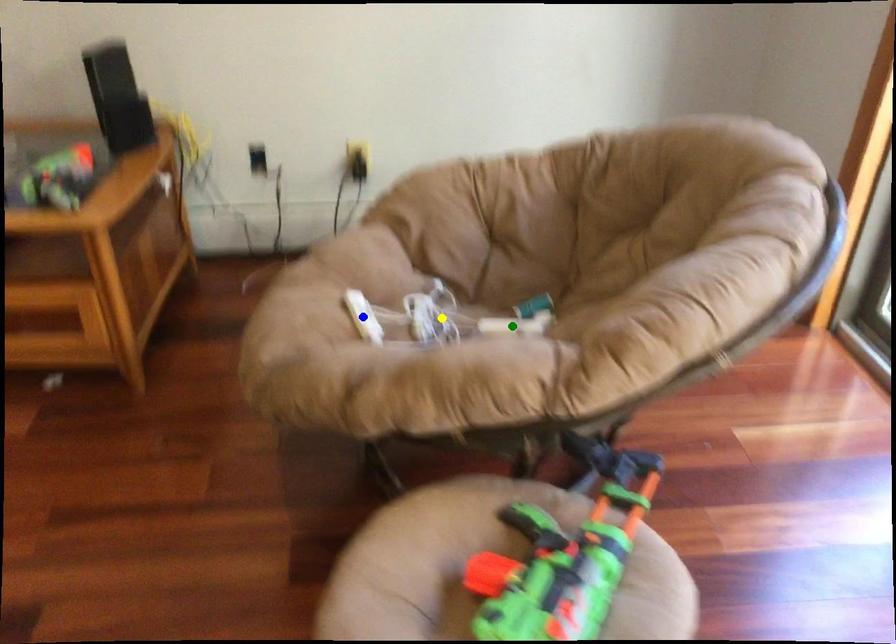
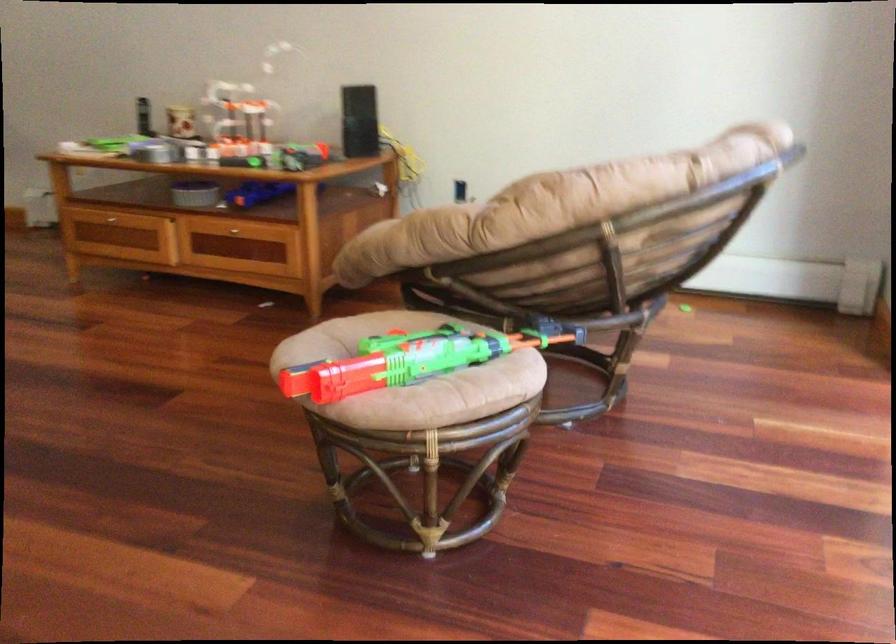
I am providing you with two images of the same scene from different viewpoints. Three points are marked in image1. Which point corresponds to a part or object that is occluded in image2?In image1, three points are marked. Which of them correspond to a part or object that is occluded in image2?Among the three points shown in image1, which one corresponds to a part or object that is no longer visible due to occlusion in image2?

blue point, yellow point, green point cannot be seen in image2.